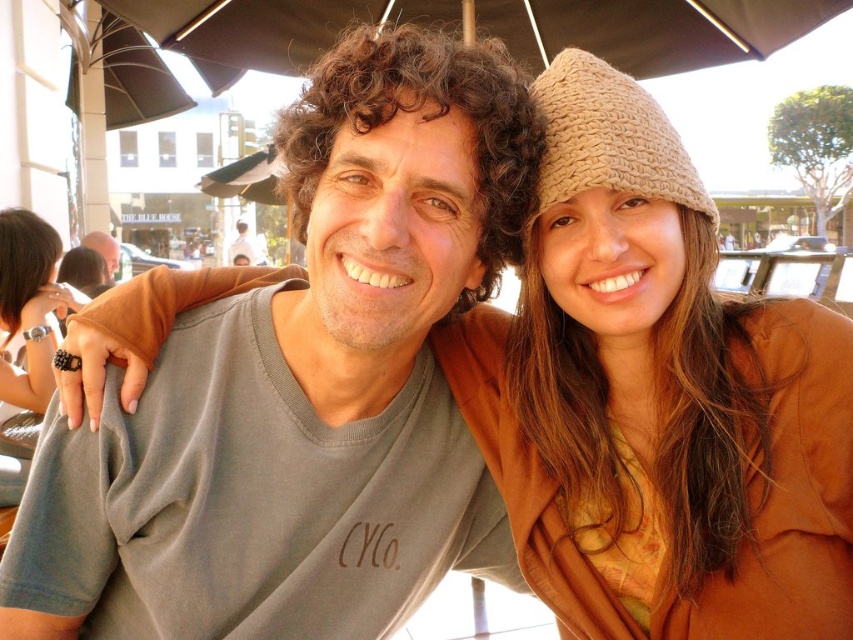
You are a photographer setting up a shot of the scene. You need to ensure both the brown knitted hat at upper right and the matte black shirt at left are in focus. Given their widths, which object requires a wider aperture setting to maintain focus?

The brown knitted hat at upper right requires a wider aperture setting because its width surpasses that of the matte black shirt at left, necessitating a larger aperture to keep it in focus.

You are standing at the point labeled as point (97, 250) and want to move to the point labeled as point (561, 112). Which direction should you move to reach your destination?

To move from point (97, 250) to point (561, 112), you should move forward since point (561, 112) is in front of point (97, 250).